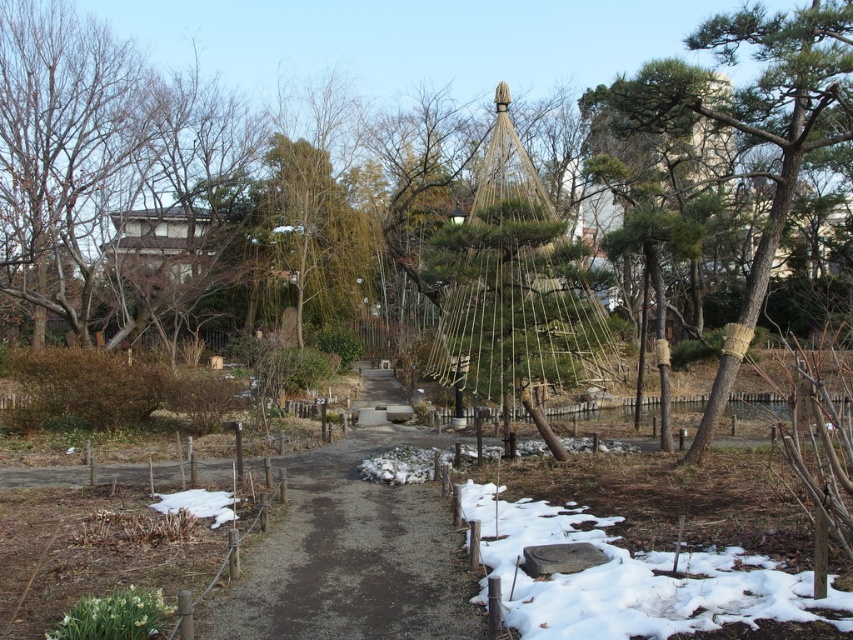
Question: Is dirt path at center in front of brown rough bark tree at right?

Choices:
 (A) yes
 (B) no

Answer: (A)

Question: Does dirt path at center appear under brown rough bark tree at right?

Choices:
 (A) yes
 (B) no

Answer: (A)

Question: Which point is closer to the camera?

Choices:
 (A) white powdery snow at lower right
 (B) dirt path at center

Answer: (A)

Question: Which point is farther to the camera?

Choices:
 (A) dirt path at center
 (B) brown rough bark tree at right
 (C) white powdery snow at lower right

Answer: (B)

Question: Can you confirm if dirt path at center is positioned above brown rough bark tree at right?

Choices:
 (A) yes
 (B) no

Answer: (B)

Question: Which point is closer to the camera?

Choices:
 (A) (750, 172)
 (B) (368, 428)
 (C) (535, 593)

Answer: (C)